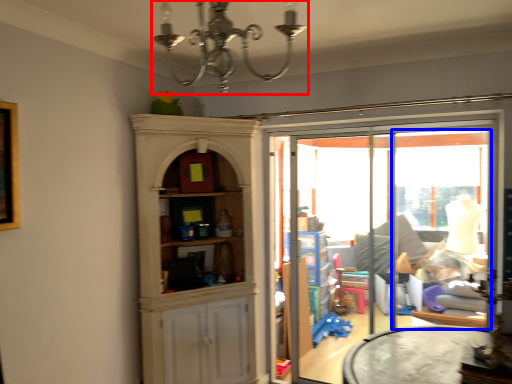
Question: Which object appears farthest to the camera in this image, light fixture (highlighted by a red box) or window (highlighted by a blue box)?

Choices:
 (A) light fixture
 (B) window

Answer: (B)